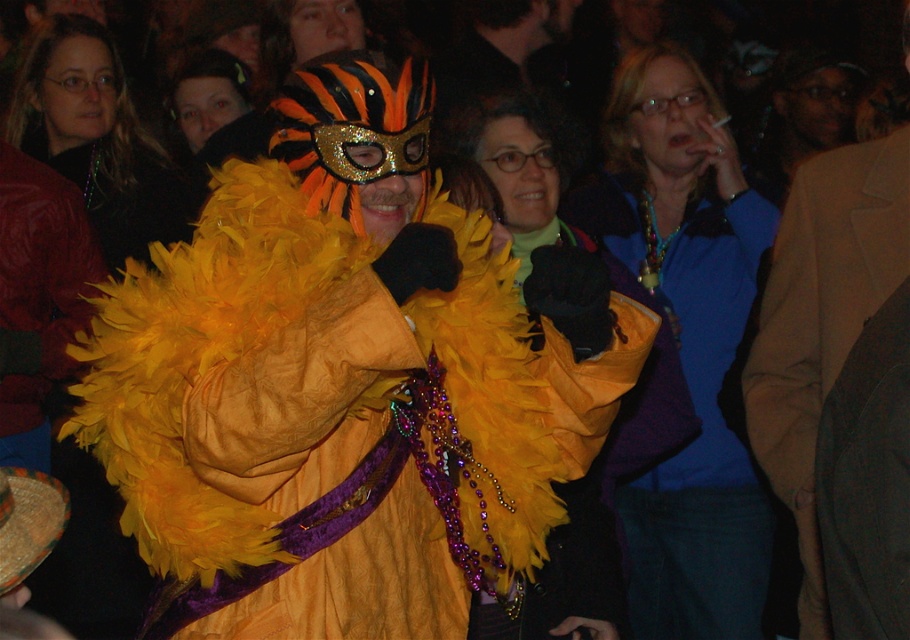
You are at a party and want to locate the feathered yellow coat at center. According to the coordinates provided, where exactly is it located?

The feathered yellow coat at center is located at coordinates point (x=704, y=440).

You are organizing a costume parade and need to arrange the feathered yellow coat at center and velvet brown coat at center in order of size from largest to smallest. Which should come first?

The feathered yellow coat at center has a larger size compared to velvet brown coat at center, so it should come first in the order from largest to smallest.